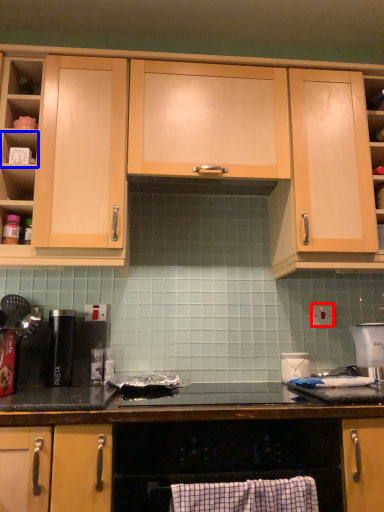
Question: Which object is further to the camera taking this photo, electric outlet (highlighted by a red box) or shelf (highlighted by a blue box)?

Choices:
 (A) electric outlet
 (B) shelf

Answer: (A)